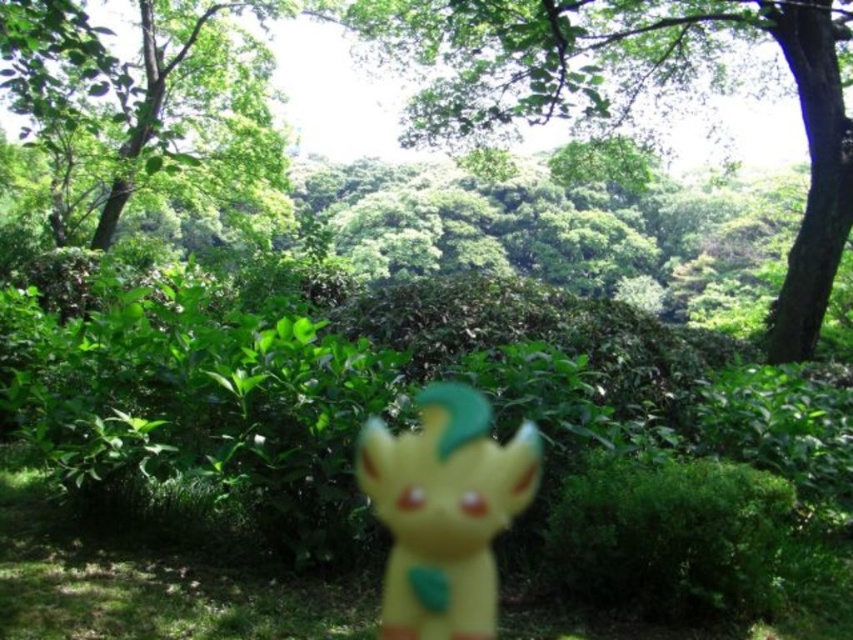
What do you see at coordinates (146, 104) in the screenshot? Image resolution: width=853 pixels, height=640 pixels. I see `green leafy tree at upper left` at bounding box center [146, 104].

Which is in front, point (59, 44) or point (520, 435)?

Point (59, 44)

Which is behind, point (223, 120) or point (409, 634)?

Positioned behind is point (223, 120).

In order to click on green leafy tree at upper left in this screenshot , I will do `click(146, 104)`.

How far apart are green leafy tree at upper center and yellow matte figurine at center?

13.12 feet

Can you confirm if green leafy tree at upper center is positioned to the left of yellow matte figurine at center?

Incorrect, green leafy tree at upper center is not on the left side of yellow matte figurine at center.

You are a GUI agent. You are given a task and a screenshot of the screen. Output one action in this format:
    pyautogui.click(x=<x>, y=<y>)
    Task: Click on the green leafy tree at upper center
    The width and height of the screenshot is (853, 640).
    Given the screenshot: What is the action you would take?
    pyautogui.click(x=631, y=92)

From the picture: Is green leafy tree at upper left wider than yellow matte grass at center?

Yes, green leafy tree at upper left is wider than yellow matte grass at center.

Locate an element on the screen. The image size is (853, 640). green leafy tree at upper left is located at coordinates (146, 104).